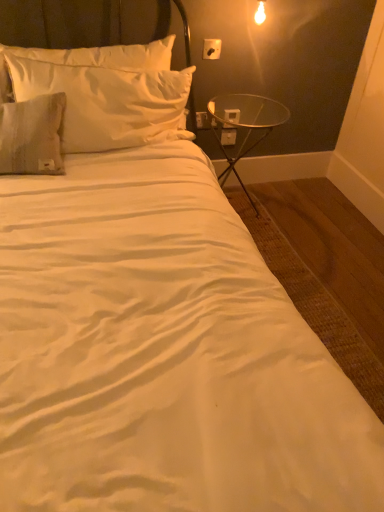
What do you see at coordinates (231, 117) in the screenshot?
I see `white plastic electric outlet at upper right, which is the second electric outlet from front to back` at bounding box center [231, 117].

Where is `satin white pillow at upper left`? Image resolution: width=384 pixels, height=512 pixels. satin white pillow at upper left is located at coordinates (107, 101).

The height and width of the screenshot is (512, 384). What are the coordinates of `pillow located on the left of white plastic electric outlet at upper right, the 2th electric outlet from the top` in the screenshot? It's located at (107, 101).

Is white plastic electric outlet at upper right, which is the second electric outlet from front to back, facing away from satin white pillow at upper left?

No, white plastic electric outlet at upper right, which is the second electric outlet from front to back, is not facing the opposite direction of satin white pillow at upper left.

Is white plastic electric outlet at upper right, which is the second electric outlet from front to back, positioned far away from satin white pillow at upper left?

No, there isn't a large distance between white plastic electric outlet at upper right, which is the second electric outlet from front to back, and satin white pillow at upper left.

Based on the photo, does white plastic electric outlet at upper right, the second electric outlet from the back, have a smaller size compared to satin white pillow at upper left?

Yes, white plastic electric outlet at upper right, the second electric outlet from the back, is smaller than satin white pillow at upper left.

From a real-world perspective, which is physically below, transparent glass table at right or white plastic electric outlet at upper right, positioned as the first electric outlet in top-to-bottom order?

transparent glass table at right.

This screenshot has height=512, width=384. Identify the location of table located in front of the white plastic electric outlet at upper right, which ranks as the 3th electric outlet in back-to-front order. (246, 124).

Can you confirm if transparent glass table at right is positioned to the left of white plastic electric outlet at upper right, which is the first electric outlet from front to back?

No, transparent glass table at right is not to the left of white plastic electric outlet at upper right, which is the first electric outlet from front to back.

From a real-world perspective, is white plastic electric outlet at upper right, positioned as the first electric outlet in top-to-bottom order, above or below white plastic electric outlet at upper right, which is the second electric outlet from front to back?

Clearly, from a real-world perspective, white plastic electric outlet at upper right, positioned as the first electric outlet in top-to-bottom order, is above white plastic electric outlet at upper right, which is the second electric outlet from front to back.

Is white plastic electric outlet at upper right, which is the first electric outlet from front to back, not close to white plastic electric outlet at upper right, the second electric outlet from the back?

white plastic electric outlet at upper right, which is the first electric outlet from front to back, is near white plastic electric outlet at upper right, the second electric outlet from the back, not far away.

Is white plastic electric outlet at upper right, positioned as the first electric outlet in top-to-bottom order, smaller than white plastic electric outlet at upper right, the 2th electric outlet from the top?

Correct, white plastic electric outlet at upper right, positioned as the first electric outlet in top-to-bottom order, occupies less space than white plastic electric outlet at upper right, the 2th electric outlet from the top.

Which point is more distant from viewer, (211, 55) or (227, 119)?

The point (211, 55) is farther from the camera.

From a real-world perspective, between white plastic electric outlet at upper right, the 2th electric outlet from the top, and transparent glass table at right, who is vertically lower?

From a 3D spatial view, transparent glass table at right is below.

Between white plastic electric outlet at upper right, the 2th electric outlet from the top, and transparent glass table at right, which one has larger size?

transparent glass table at right is bigger.

Considering the relative positions of white plastic electric outlet at upper right, the second electric outlet in the bottom-to-top sequence, and transparent glass table at right in the image provided, is white plastic electric outlet at upper right, the second electric outlet in the bottom-to-top sequence, to the left or to the right of transparent glass table at right?

In the image, white plastic electric outlet at upper right, the second electric outlet in the bottom-to-top sequence, appears on the left side of transparent glass table at right.

How much distance is there between white plastic electric outlet at upper right, the 2th electric outlet from the top, and transparent glass table at right?

white plastic electric outlet at upper right, the 2th electric outlet from the top, is 13.66 inches from transparent glass table at right.

Which is in front, point (216, 42) or point (233, 143)?

Positioned in front is point (216, 42).

Looking at this image, which is more to the right, white plastic electric outlet at upper right, which ranks as the 3th electric outlet in back-to-front order, or white plastic electric outlet at upper right, arranged as the 1th electric outlet when viewed from the back?

Positioned to the right is white plastic electric outlet at upper right, arranged as the 1th electric outlet when viewed from the back.

In the image, is white plastic electric outlet at upper right, positioned as the first electric outlet in top-to-bottom order, positioned in front of or behind white plastic electric outlet at upper right, arranged as the third electric outlet when viewed from the top?

Clearly, white plastic electric outlet at upper right, positioned as the first electric outlet in top-to-bottom order, is in front of white plastic electric outlet at upper right, arranged as the third electric outlet when viewed from the top.

Is white plastic electric outlet at upper right, which is the first electric outlet from front to back, taller or shorter than white plastic electric outlet at upper right, arranged as the third electric outlet when viewed from the top?

Considering their sizes, white plastic electric outlet at upper right, which is the first electric outlet from front to back, has more height than white plastic electric outlet at upper right, arranged as the third electric outlet when viewed from the top.

Is white plastic electric outlet at upper right, arranged as the third electric outlet when viewed from the top, to the left or to the right of white plastic electric outlet at upper right, which is the first electric outlet from front to back, in the image?

Clearly, white plastic electric outlet at upper right, arranged as the third electric outlet when viewed from the top, is on the right of white plastic electric outlet at upper right, which is the first electric outlet from front to back, in the image.

From a real-world perspective, is white plastic electric outlet at upper right, arranged as the 1th electric outlet when viewed from the back, positioned above or below white plastic electric outlet at upper right, positioned as the first electric outlet in top-to-bottom order?

In terms of real-world spatial position, white plastic electric outlet at upper right, arranged as the 1th electric outlet when viewed from the back, is below white plastic electric outlet at upper right, positioned as the first electric outlet in top-to-bottom order.

Between white plastic electric outlet at upper right, marked as the first electric outlet in a bottom-to-top arrangement, and white plastic electric outlet at upper right, which is the first electric outlet from front to back, which one has larger width?

white plastic electric outlet at upper right, which is the first electric outlet from front to back.

From a real-world perspective, is satin white pillow at upper left physically below white plastic electric outlet at upper right, marked as the first electric outlet in a bottom-to-top arrangement?

No.

The image size is (384, 512). Identify the location of pillow lying in front of the white plastic electric outlet at upper right, the 3th electric outlet positioned from the front. (107, 101).

Is satin white pillow at upper left oriented towards white plastic electric outlet at upper right, marked as the first electric outlet in a bottom-to-top arrangement?

No, satin white pillow at upper left is not turned towards white plastic electric outlet at upper right, marked as the first electric outlet in a bottom-to-top arrangement.

Between point (29, 63) and point (223, 145), which one is positioned behind?

The point (223, 145) is more distant.

Image resolution: width=384 pixels, height=512 pixels. Identify the location of pillow that is above the white plastic electric outlet at upper right, the second electric outlet in the bottom-to-top sequence (from a real-world perspective). (107, 101).

There is a transparent glass table at right. Where is `the 3rd electric outlet above it (from the image's perspective)`? Image resolution: width=384 pixels, height=512 pixels. the 3rd electric outlet above it (from the image's perspective) is located at coordinates (211, 49).

Based on their spatial positions, is satin white pillow at upper left or white plastic electric outlet at upper right, which ranks as the 3th electric outlet in back-to-front order, closer to transparent glass table at right?

Based on the image, white plastic electric outlet at upper right, which ranks as the 3th electric outlet in back-to-front order, appears to be nearer to transparent glass table at right.

When comparing their distances from white plastic electric outlet at upper right, arranged as the 1th electric outlet when viewed from the back, does transparent glass table at right or satin white pillow at upper left seem further?

satin white pillow at upper left is further to white plastic electric outlet at upper right, arranged as the 1th electric outlet when viewed from the back.

From the image, which object appears to be nearer to white plastic electric outlet at upper right, the second electric outlet from the back, satin white pillow at upper left or transparent glass table at right?

Among the two, transparent glass table at right is located nearer to white plastic electric outlet at upper right, the second electric outlet from the back.

When comparing their distances from white plastic electric outlet at upper right, the 2th electric outlet from the top, does transparent glass table at right or white plastic electric outlet at upper right, which ranks as the 3th electric outlet in back-to-front order, seem closer?

transparent glass table at right is positioned closer to the anchor white plastic electric outlet at upper right, the 2th electric outlet from the top.

When comparing their distances from white plastic electric outlet at upper right, which ranks as the 3th electric outlet in back-to-front order, does white plastic electric outlet at upper right, the second electric outlet in the bottom-to-top sequence, or transparent glass table at right seem further?

Based on the image, transparent glass table at right appears to be further to white plastic electric outlet at upper right, which ranks as the 3th electric outlet in back-to-front order.

Looking at the image, which one is located closer to white plastic electric outlet at upper right, the 2th electric outlet from the top, white plastic electric outlet at upper right, positioned as the first electric outlet in top-to-bottom order, or white plastic electric outlet at upper right, the 3th electric outlet positioned from the front?

white plastic electric outlet at upper right, positioned as the first electric outlet in top-to-bottom order, is closer to white plastic electric outlet at upper right, the 2th electric outlet from the top.

From the image, which object appears to be farther from transparent glass table at right, satin white pillow at upper left or white plastic electric outlet at upper right, the second electric outlet in the bottom-to-top sequence?

Based on the image, satin white pillow at upper left appears to be further to transparent glass table at right.

From the image, which object appears to be nearer to transparent glass table at right, white plastic electric outlet at upper right, which is the second electric outlet from front to back, or white plastic electric outlet at upper right, which is the first electric outlet from front to back?

white plastic electric outlet at upper right, which is the second electric outlet from front to back, is positioned closer to the anchor transparent glass table at right.

This screenshot has width=384, height=512. What are the coordinates of `electric outlet between transparent glass table at right and white plastic electric outlet at upper right, the second electric outlet from the back, along the z-axis` in the screenshot? It's located at (211, 49).

Where is `table between satin white pillow at upper left and white plastic electric outlet at upper right, marked as the first electric outlet in a bottom-to-top arrangement, from front to back`? table between satin white pillow at upper left and white plastic electric outlet at upper right, marked as the first electric outlet in a bottom-to-top arrangement, from front to back is located at coordinates (246, 124).

Where is `electric outlet between satin white pillow at upper left and white plastic electric outlet at upper right, the second electric outlet from the back, along the z-axis`? This screenshot has height=512, width=384. electric outlet between satin white pillow at upper left and white plastic electric outlet at upper right, the second electric outlet from the back, along the z-axis is located at coordinates (211, 49).

Where is `electric outlet positioned between white plastic electric outlet at upper right, the third electric outlet positioned from the bottom, and white plastic electric outlet at upper right, arranged as the third electric outlet when viewed from the top, from near to far`? This screenshot has height=512, width=384. electric outlet positioned between white plastic electric outlet at upper right, the third electric outlet positioned from the bottom, and white plastic electric outlet at upper right, arranged as the third electric outlet when viewed from the top, from near to far is located at coordinates (231, 117).